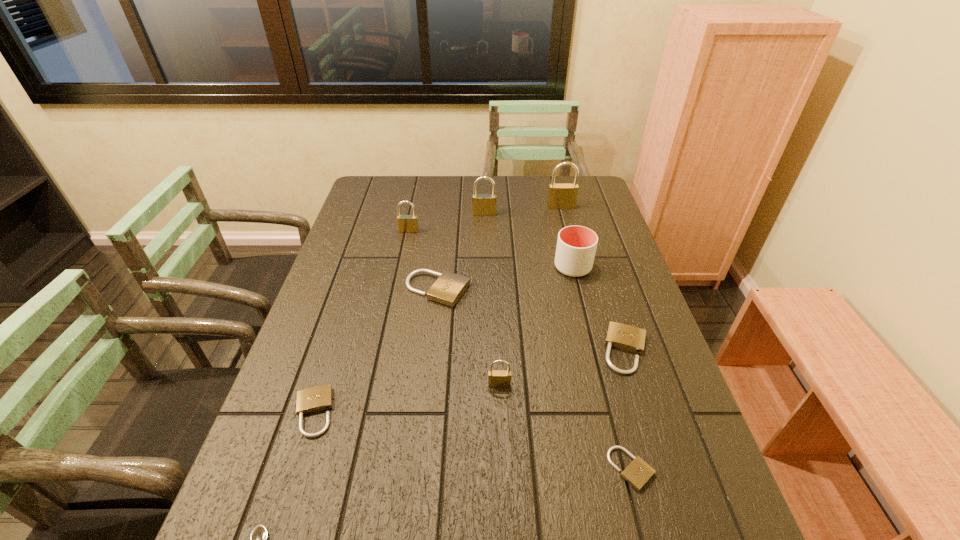
Locate an element on the screen. Image resolution: width=960 pixels, height=540 pixels. the farthest object is located at coordinates (560, 196).

Where is `the biggest brass padlock`? Image resolution: width=960 pixels, height=540 pixels. the biggest brass padlock is located at coordinates (560, 196).

Find the location of a particular element. The height and width of the screenshot is (540, 960). the second biggest brass padlock is located at coordinates (482, 204).

Where is `the seventh shortest padlock`? The height and width of the screenshot is (540, 960). the seventh shortest padlock is located at coordinates coord(482,204).

Image resolution: width=960 pixels, height=540 pixels. In order to click on the leftmost brass padlock in this screenshot , I will do `click(406, 223)`.

The image size is (960, 540). In order to click on the sixth nearest padlock in this screenshot , I will do `click(406, 223)`.

Locate an element on the screen. white cup is located at coordinates (576, 245).

Image resolution: width=960 pixels, height=540 pixels. Find the location of `the smallest brass padlock`. the smallest brass padlock is located at coordinates (496, 378).

You are a GUI agent. You are given a task and a screenshot of the screen. Output one action in this format:
    pyautogui.click(x=<x>, y=<y>)
    Task: Click on the nearest brass padlock
    
    Given the screenshot: What is the action you would take?
    pyautogui.click(x=496, y=378)

This screenshot has height=540, width=960. I want to click on the fifth tallest padlock, so click(449, 287).